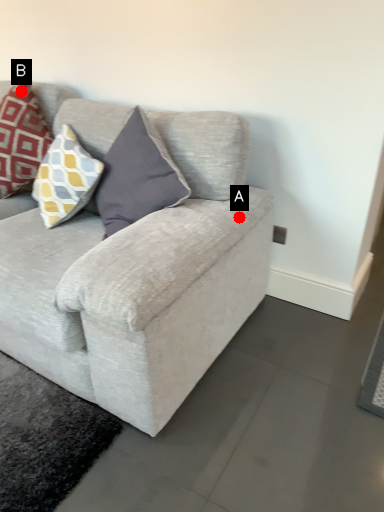
Question: Two points are circled on the image, labeled by A and B beside each circle. Which point appears closest to the camera in this image?

Choices:
 (A) A is closer
 (B) B is closer

Answer: (A)